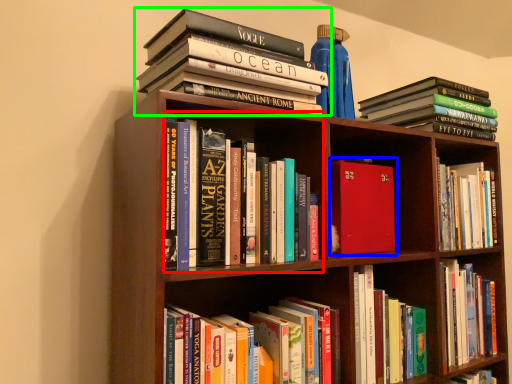
Question: Which object is positioned farthest from book (highlighted by a red box)? Select from book (highlighted by a blue box) and book (highlighted by a green box).

Choices:
 (A) book
 (B) book

Answer: (A)